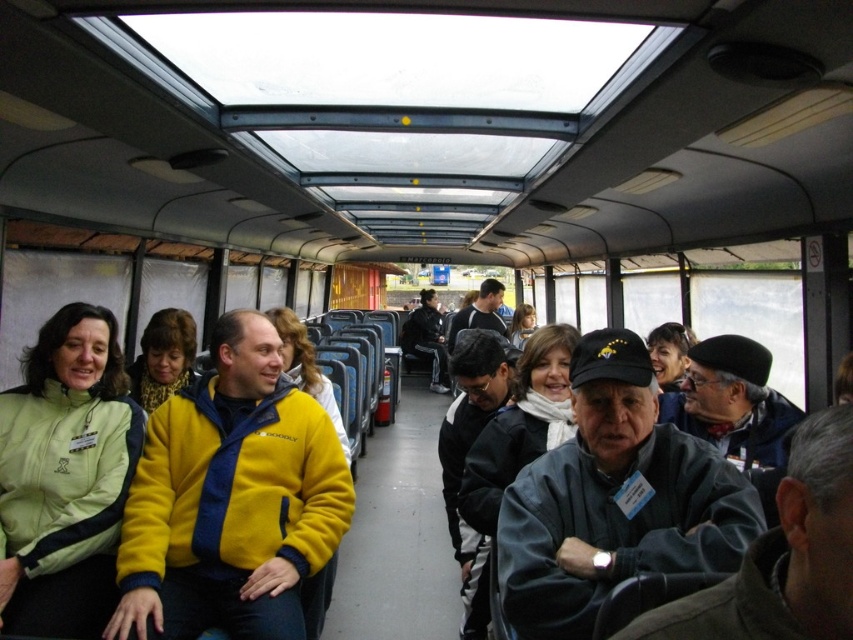
Question: Which point is farther from the camera taking this photo?

Choices:
 (A) (215, 563)
 (B) (103, 502)

Answer: (B)

Question: Which of the following is the farthest from the observer?

Choices:
 (A) light green fleece jacket at left
 (B) yellow fleece jacket at center

Answer: (A)

Question: Which of the following is the farthest from the observer?

Choices:
 (A) (160, 552)
 (B) (15, 456)

Answer: (B)

Question: Does yellow fleece jacket at center appear on the left side of light green fleece jacket at left?

Choices:
 (A) yes
 (B) no

Answer: (B)

Question: Is yellow fleece jacket at center thinner than light green fleece jacket at left?

Choices:
 (A) yes
 (B) no

Answer: (B)

Question: Is yellow fleece jacket at center to the right of light green fleece jacket at left from the viewer's perspective?

Choices:
 (A) yes
 (B) no

Answer: (A)